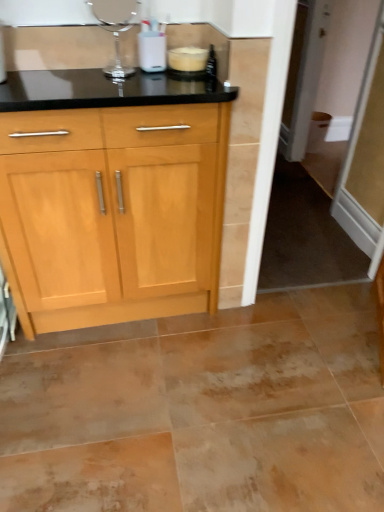
Question: Which direction should I rotate to look at clear glass vase at upper center, marked as the 1th appliance in a left-to-right arrangement, — up or down?

Choices:
 (A) up
 (B) down

Answer: (A)

Question: Is clear glass vase at upper center, the 2th appliance in the right-to-left sequence, not within transparent glass screen door at right?

Choices:
 (A) yes
 (B) no

Answer: (A)

Question: Is the surface of clear glass vase at upper center, marked as the 1th appliance in a left-to-right arrangement, in direct contact with transparent glass screen door at right?

Choices:
 (A) yes
 (B) no

Answer: (B)

Question: Is transparent glass screen door at right inside clear glass vase at upper center, the 2th appliance in the right-to-left sequence?

Choices:
 (A) yes
 (B) no

Answer: (B)

Question: Is clear glass vase at upper center, the 2th appliance in the right-to-left sequence, taller than transparent glass screen door at right?

Choices:
 (A) no
 (B) yes

Answer: (A)

Question: Is clear glass vase at upper center, the 2th appliance in the right-to-left sequence, closer to the viewer compared to transparent glass screen door at right?

Choices:
 (A) no
 (B) yes

Answer: (B)

Question: From the image's perspective, is clear glass vase at upper center, the 2th appliance in the right-to-left sequence, over transparent glass screen door at right?

Choices:
 (A) no
 (B) yes

Answer: (A)

Question: Does transparent glass screen door at right have a larger size compared to clear glass vase at upper center, the 2th appliance in the right-to-left sequence?

Choices:
 (A) no
 (B) yes

Answer: (B)

Question: Is transparent glass screen door at right further to the viewer compared to clear glass vase at upper center, the 2th appliance in the right-to-left sequence?

Choices:
 (A) no
 (B) yes

Answer: (B)

Question: Is transparent glass screen door at right beside clear glass vase at upper center, marked as the 1th appliance in a left-to-right arrangement?

Choices:
 (A) no
 (B) yes

Answer: (A)

Question: From the image's perspective, does transparent glass screen door at right appear higher than clear glass vase at upper center, the 2th appliance in the right-to-left sequence?

Choices:
 (A) yes
 (B) no

Answer: (A)

Question: Considering the relative positions of transparent glass screen door at right and clear glass vase at upper center, the 2th appliance in the right-to-left sequence, in the image provided, is transparent glass screen door at right to the right of clear glass vase at upper center, the 2th appliance in the right-to-left sequence, from the viewer's perspective?

Choices:
 (A) no
 (B) yes

Answer: (B)

Question: Is transparent glass screen door at right aimed at clear glass vase at upper center, the 2th appliance in the right-to-left sequence?

Choices:
 (A) no
 (B) yes

Answer: (A)

Question: Can you confirm if white plastic container at upper center, arranged as the second appliance when viewed from the left, is shorter than transparent glass screen door at right?

Choices:
 (A) yes
 (B) no

Answer: (A)